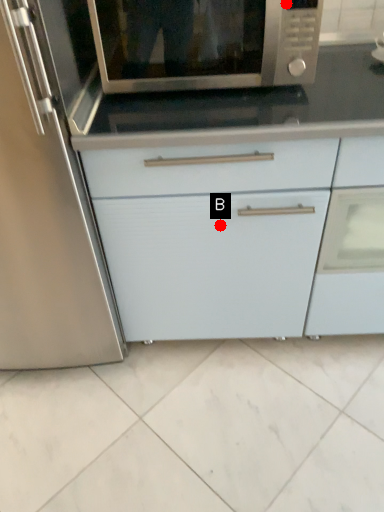
Question: Two points are circled on the image, labeled by A and B beside each circle. Which point is closer to the camera?

Choices:
 (A) A is closer
 (B) B is closer

Answer: (A)